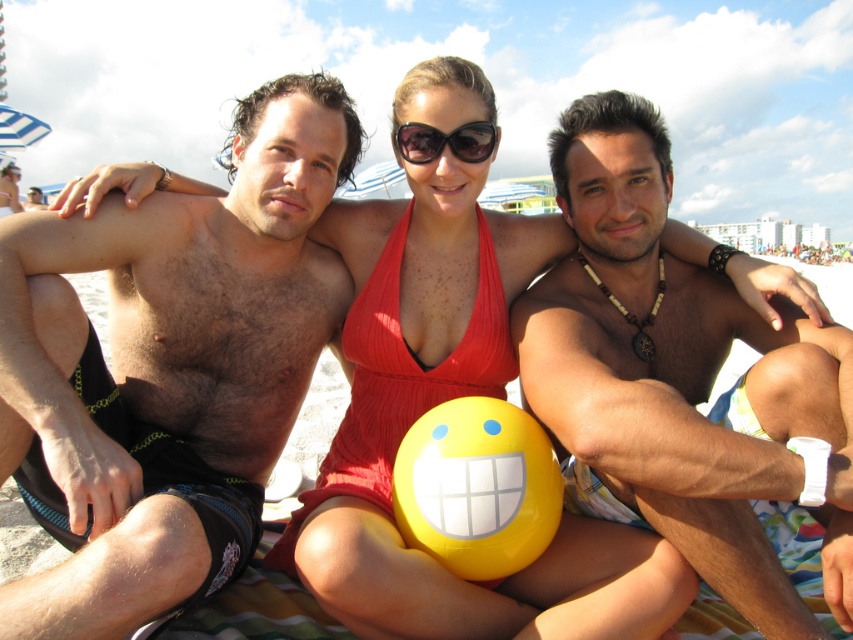
Question: Which of the following is the closest to the observer?

Choices:
 (A) yellow matte/vinyl volleyball at center
 (B) matte red swimsuit at center
 (C) smooth tan skin at center

Answer: (C)

Question: Which object is the farthest from the matte red swimsuit at center?

Choices:
 (A) sunglasses at center
 (B) smooth tan skin at center
 (C) yellow matte/vinyl volleyball at center
 (D) hairy skin at left

Answer: (B)

Question: Can you confirm if hairy skin at left is positioned below smooth tan skin at center?

Choices:
 (A) yes
 (B) no

Answer: (B)

Question: Does hairy skin at left have a lesser width compared to yellow matte/vinyl volleyball at center?

Choices:
 (A) yes
 (B) no

Answer: (B)

Question: Can you confirm if smooth tan skin at center is positioned to the left of matte red swimsuit at center?

Choices:
 (A) yes
 (B) no

Answer: (B)

Question: Which point appears farthest from the camera in this image?

Choices:
 (A) (548, 518)
 (B) (322, 172)

Answer: (B)